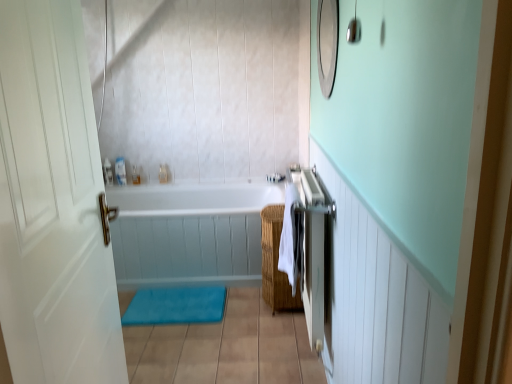
I want to click on free space in front of blue fabric bath mat at lower center, so click(x=184, y=345).